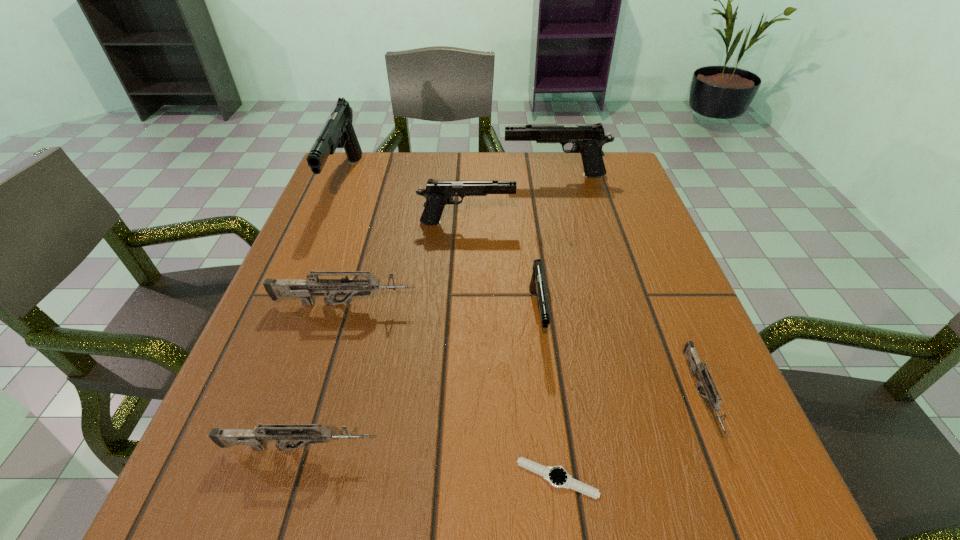
Locate an element on the screen. This screenshot has height=540, width=960. vacant space located aimed along the barrel of the biggest grey gun is located at coordinates (535, 304).

This screenshot has width=960, height=540. I want to click on free space located 0.150m aimed along the barrel of the sixth tallest gun, so click(480, 448).

Find the location of `vacant region located 0.070m aimed along the barrel of the rightmost grey gun`. vacant region located 0.070m aimed along the barrel of the rightmost grey gun is located at coordinates (741, 498).

Find the location of a particular element. free space located on the back of the nearest object is located at coordinates (536, 305).

This screenshot has width=960, height=540. I want to click on object that is at the near edge, so click(557, 476).

The height and width of the screenshot is (540, 960). What are the coordinates of `object located at the far left corner` in the screenshot? It's located at (338, 132).

Locate an element on the screen. This screenshot has width=960, height=540. object at the far right corner is located at coordinates (588, 140).

Where is `vacant area at the far edge of the desktop`? Image resolution: width=960 pixels, height=540 pixels. vacant area at the far edge of the desktop is located at coordinates (485, 179).

Where is `free spot at the near edge of the desktop`? free spot at the near edge of the desktop is located at coordinates (477, 472).

Image resolution: width=960 pixels, height=540 pixels. In order to click on vacant space at the left edge of the desktop in this screenshot , I will do `click(279, 397)`.